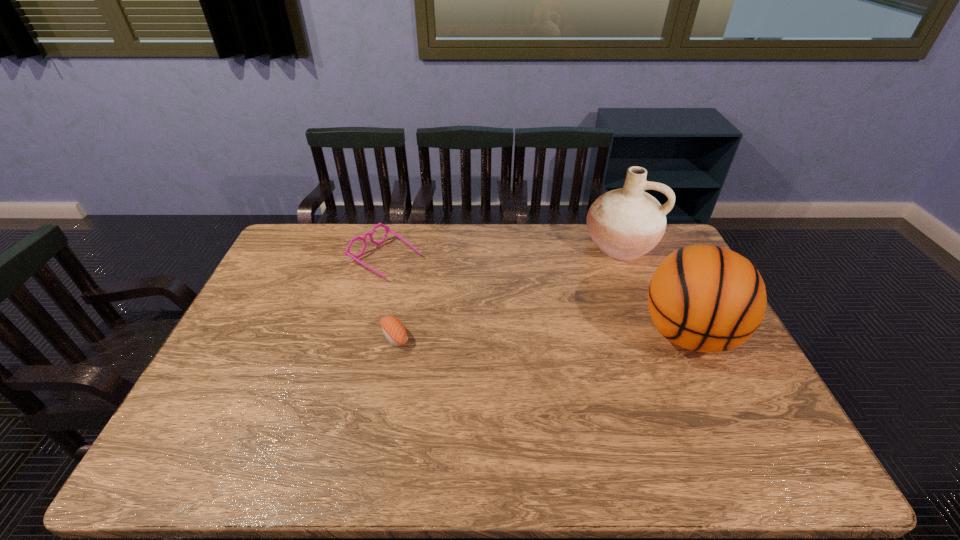
Identify the location of the shortest object. This screenshot has height=540, width=960. (393, 329).

The image size is (960, 540). I want to click on basketball, so click(705, 298).

This screenshot has width=960, height=540. In order to click on pottery in this screenshot , I will do `click(626, 223)`.

You are a GUI agent. You are given a task and a screenshot of the screen. Output one action in this format:
    pyautogui.click(x=<x>, y=<y>)
    Task: Click on the spectacles
    
    Given the screenshot: What is the action you would take?
    pyautogui.click(x=347, y=252)

The image size is (960, 540). Find the location of `free space located 0.310m on the left of the sushi`. free space located 0.310m on the left of the sushi is located at coordinates (273, 336).

Identify the location of vacant space located on the back of the basketball. (666, 287).

Where is `vacant region located to pour from the handle of the pottery`? This screenshot has height=540, width=960. vacant region located to pour from the handle of the pottery is located at coordinates (589, 321).

In order to click on vacant space situated 0.290m to pour from the handle of the pottery in this screenshot , I will do (589, 321).

At what (x,y) coordinates should I click in order to perform the action: click on vacant space located 0.230m to pour from the handle of the pottery. Please return your answer as a coordinate pair (x, y). This screenshot has height=540, width=960. Looking at the image, I should click on 594,309.

At what (x,y) coordinates should I click in order to perform the action: click on free space located on the arms of the spectacles. Please return your answer as a coordinate pair (x, y). This screenshot has height=540, width=960. Looking at the image, I should click on (435, 287).